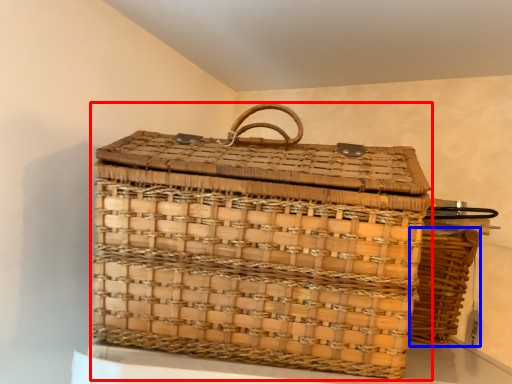
Question: Which object is further to the camera taking this photo, picnic basket (highlighted by a red box) or picnic basket (highlighted by a blue box)?

Choices:
 (A) picnic basket
 (B) picnic basket

Answer: (B)